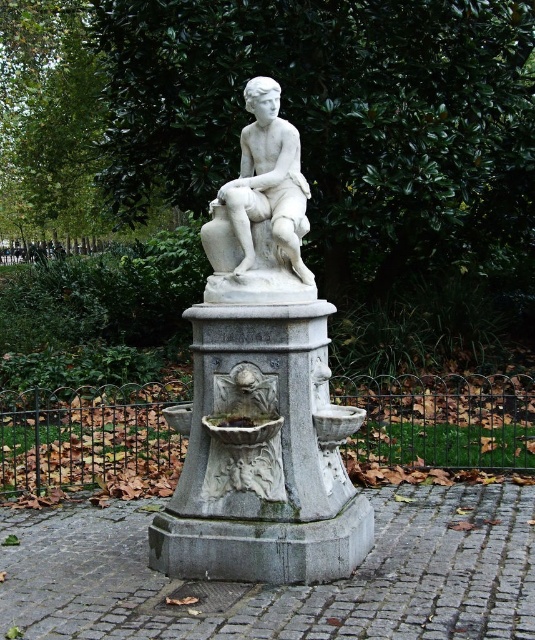
Does point (110, 445) lie behind point (285, 172)?

Yes, point (110, 445) is behind point (285, 172).

Who is taller, iron wire fence at center or white marble statue at center?

white marble statue at center

Locate an element on the screen. iron wire fence at center is located at coordinates (90, 440).

Does gray stone fountain at center appear over iron wire fence at center?

Yes.

Based on the photo, who is more distant from viewer, [167,406] or [452,412]?

The point [452,412] is behind.

I want to click on gray stone fountain at center, so click(x=262, y=454).

What do you see at coordinates (262, 454) in the screenshot? I see `gray stone fountain at center` at bounding box center [262, 454].

Is point (327, 381) closer to viewer compared to point (242, 157)?

Yes, it is.

This screenshot has width=535, height=640. I want to click on gray stone fountain at center, so click(262, 454).